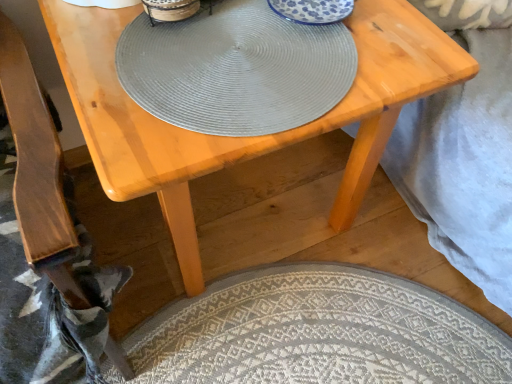
Question: Does matte gray placemat at center have a lesser height compared to wooden armchair at lower left?

Choices:
 (A) no
 (B) yes

Answer: (B)

Question: Is matte gray placemat at center wider than wooden armchair at lower left?

Choices:
 (A) yes
 (B) no

Answer: (B)

Question: Are matte gray placemat at center and wooden armchair at lower left located far from each other?

Choices:
 (A) no
 (B) yes

Answer: (A)

Question: From the image's perspective, is matte gray placemat at center over wooden armchair at lower left?

Choices:
 (A) no
 (B) yes

Answer: (B)

Question: Is matte gray placemat at center at the right side of wooden armchair at lower left?

Choices:
 (A) yes
 (B) no

Answer: (A)

Question: Considering the positions of point (159, 13) and point (372, 29), is point (159, 13) closer or farther from the camera than point (372, 29)?

Choices:
 (A) farther
 (B) closer

Answer: (B)

Question: From the image's perspective, is matte gray placemat at center positioned above or below light wood table at center?

Choices:
 (A) below
 (B) above

Answer: (B)

Question: Looking at their shapes, would you say matte gray placemat at center is wider or thinner than light wood table at center?

Choices:
 (A) thin
 (B) wide

Answer: (A)

Question: Would you say matte gray placemat at center is to the left or to the right of light wood table at center in the picture?

Choices:
 (A) left
 (B) right

Answer: (A)

Question: From the image's perspective, is light wood table at center positioned above or below matte gray placemat at center?

Choices:
 (A) above
 (B) below

Answer: (B)

Question: Is point (159, 152) positioned closer to the camera than point (204, 127)?

Choices:
 (A) closer
 (B) farther

Answer: (A)

Question: Is light wood table at center taller or shorter than matte gray placemat at center?

Choices:
 (A) short
 (B) tall

Answer: (B)

Question: Considering their positions, is light wood table at center located in front of or behind matte gray placemat at center?

Choices:
 (A) behind
 (B) front

Answer: (B)

Question: From the image's perspective, relative to neutral woven mat at lower center, is matte gray placemat at center above or below?

Choices:
 (A) above
 (B) below

Answer: (A)

Question: Looking at the image, does matte gray placemat at center seem bigger or smaller compared to neutral woven mat at lower center?

Choices:
 (A) small
 (B) big

Answer: (A)